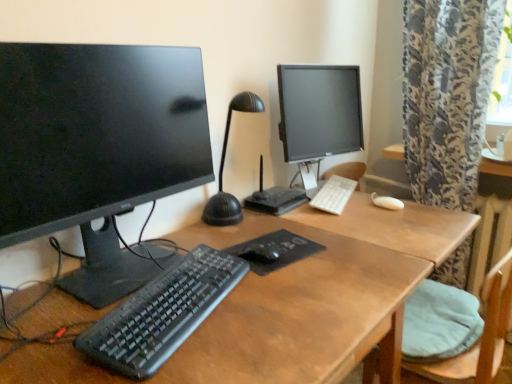
What do you see at coordinates (334, 195) in the screenshot? This screenshot has width=512, height=384. I see `white plastic keyboard at center, the first computer keyboard from the right` at bounding box center [334, 195].

In order to face wooden desk at center, should I rotate leftwards or rightwards?

Turn right by 2.438 degrees to look at wooden desk at center.

This screenshot has height=384, width=512. What do you see at coordinates (293, 302) in the screenshot? I see `wooden desk at center` at bounding box center [293, 302].

This screenshot has height=384, width=512. What do you see at coordinates (274, 251) in the screenshot? I see `black textured mousepad at center` at bounding box center [274, 251].

The image size is (512, 384). What do you see at coordinates (319, 115) in the screenshot? I see `matte black monitor at center, which is counted as the 2th computer monitor, starting from the left` at bounding box center [319, 115].

What do you see at coordinates (261, 253) in the screenshot? I see `black matte mouse at center` at bounding box center [261, 253].

In order to face matte black monitor at left, marked as the second computer monitor in a right-to-left arrangement, should I rotate leftwards or rightwards?

Turn left by 18.591 degrees to look at matte black monitor at left, marked as the second computer monitor in a right-to-left arrangement.

Describe the element at coordinates (97, 148) in the screenshot. The height and width of the screenshot is (384, 512). I see `matte black monitor at left, the first computer monitor when ordered from left to right` at that location.

This screenshot has width=512, height=384. Describe the element at coordinates (162, 313) in the screenshot. I see `black plastic keyboard at center, the first computer keyboard positioned from the bottom` at that location.

What are the coordinates of `light blue fabric cushion at lower right` in the screenshot? It's located at (481, 336).

I want to click on white plastic keyboard at center, which appears as the second computer keyboard when viewed from the front, so click(x=334, y=195).

Which is behind, point (339, 179) or point (143, 104)?

The point (339, 179) is farther from the camera.

Would you say white plastic keyboard at center, which appears as the 2th computer keyboard when viewed from the left, is to the left or to the right of matte black monitor at left, marked as the second computer monitor in a right-to-left arrangement, in the picture?

Based on their positions, white plastic keyboard at center, which appears as the 2th computer keyboard when viewed from the left, is located to the right of matte black monitor at left, marked as the second computer monitor in a right-to-left arrangement.

From a real-world perspective, is white plastic keyboard at center, which appears as the 2th computer keyboard when viewed from the left, positioned under matte black monitor at left, marked as the second computer monitor in a right-to-left arrangement, based on gravity?

Yes, from a real-world perspective, white plastic keyboard at center, which appears as the 2th computer keyboard when viewed from the left, is beneath matte black monitor at left, marked as the second computer monitor in a right-to-left arrangement.

In terms of width, does white plastic keyboard at center, which appears as the second computer keyboard when viewed from the front, look wider or thinner when compared to matte black monitor at left, placed as the 2th computer monitor when sorted from back to front?

Clearly, white plastic keyboard at center, which appears as the second computer keyboard when viewed from the front, has less width compared to matte black monitor at left, placed as the 2th computer monitor when sorted from back to front.

Considering the relative sizes of matte black monitor at left, placed as the 2th computer monitor when sorted from back to front, and black matte mouse at center in the image provided, is matte black monitor at left, placed as the 2th computer monitor when sorted from back to front, thinner than black matte mouse at center?

No, matte black monitor at left, placed as the 2th computer monitor when sorted from back to front, is not thinner than black matte mouse at center.

Considering the sizes of matte black monitor at left, marked as the second computer monitor in a right-to-left arrangement, and black matte mouse at center in the image, is matte black monitor at left, marked as the second computer monitor in a right-to-left arrangement, taller or shorter than black matte mouse at center?

In the image, matte black monitor at left, marked as the second computer monitor in a right-to-left arrangement, appears to be taller than black matte mouse at center.

Is matte black monitor at left, which is the 1th computer monitor from front to back, to the left of black matte mouse at center from the viewer's perspective?

Yes.

Are white plastic keyboard at center, which appears as the 1th computer keyboard when viewed from the back, and black plastic keyboard at center, the 2th computer keyboard viewed from the back, making contact?

No, white plastic keyboard at center, which appears as the 1th computer keyboard when viewed from the back, is not with black plastic keyboard at center, the 2th computer keyboard viewed from the back.

Between white plastic keyboard at center, which appears as the second computer keyboard when viewed from the front, and black plastic keyboard at center, the 2th computer keyboard viewed from the back, which one has smaller size?

white plastic keyboard at center, which appears as the second computer keyboard when viewed from the front.

Considering the relative positions of white plastic keyboard at center, which appears as the second computer keyboard when viewed from the front, and black plastic keyboard at center, the 1th computer keyboard in the front-to-back sequence, in the image provided, is white plastic keyboard at center, which appears as the second computer keyboard when viewed from the front, to the left of black plastic keyboard at center, the 1th computer keyboard in the front-to-back sequence, from the viewer's perspective?

No.

I want to click on computer keyboard above the black plastic keyboard at center, the 2th computer keyboard viewed from the back (from the image's perspective), so click(x=334, y=195).

Which is less distant, (449, 366) or (249, 247)?

Point (449, 366) is farther from the camera than point (249, 247).

Considering the sizes of objects light blue fabric cushion at lower right and black matte mouse at center in the image provided, who is bigger, light blue fabric cushion at lower right or black matte mouse at center?

With larger size is light blue fabric cushion at lower right.

Are light blue fabric cushion at lower right and black matte mouse at center far apart?

That's not correct — light blue fabric cushion at lower right is a little close to black matte mouse at center.

Can you confirm if black plastic keyboard at center, the 2th computer keyboard viewed from the back, is thinner than wooden desk at center?

Correct, the width of black plastic keyboard at center, the 2th computer keyboard viewed from the back, is less than that of wooden desk at center.

Considering the relative sizes of black plastic keyboard at center, placed as the second computer keyboard when sorted from top to bottom, and wooden desk at center in the image provided, is black plastic keyboard at center, placed as the second computer keyboard when sorted from top to bottom, bigger than wooden desk at center?

Actually, black plastic keyboard at center, placed as the second computer keyboard when sorted from top to bottom, might be smaller than wooden desk at center.

Considering the relative positions of black plastic keyboard at center, the first computer keyboard positioned from the bottom, and wooden desk at center in the image provided, is black plastic keyboard at center, the first computer keyboard positioned from the bottom, to the left or to the right of wooden desk at center?

black plastic keyboard at center, the first computer keyboard positioned from the bottom, is positioned on wooden desk at center's left side.

How different are the orientations of black plastic keyboard at center, placed as the second computer keyboard when sorted from top to bottom, and wooden desk at center in degrees?

The facing directions of black plastic keyboard at center, placed as the second computer keyboard when sorted from top to bottom, and wooden desk at center are 17.7 degrees apart.

Is black textured mousepad at center oriented towards black matte mouse at center?

No.

Is black textured mousepad at center positioned before black matte mouse at center?

Yes, it is in front of black matte mouse at center.

Which of these two, black textured mousepad at center or black matte mouse at center, is smaller?

black matte mouse at center.

Between black textured mousepad at center and black matte mouse at center, which one appears on the left side from the viewer's perspective?

black matte mouse at center.

Is point (238, 252) more distant than point (231, 278)?

That is True.

Which object is wider, black textured mousepad at center or black plastic keyboard at center, placed as the second computer keyboard when sorted from top to bottom?

black textured mousepad at center is wider.

Would you say black textured mousepad at center is to the left or to the right of black plastic keyboard at center, the 1th computer keyboard in the front-to-back sequence, in the picture?

Clearly, black textured mousepad at center is on the right of black plastic keyboard at center, the 1th computer keyboard in the front-to-back sequence, in the image.

How much distance is there between black textured mousepad at center and black plastic keyboard at center, the 1th computer keyboard in the front-to-back sequence?

8.51 inches.

The image size is (512, 384). I want to click on the 1st computer keyboard below the matte black monitor at left, placed as the 2th computer monitor when sorted from back to front (from the image's perspective), so click(x=334, y=195).

Where is `mouse below the matte black monitor at left, marked as the second computer monitor in a right-to-left arrangement (from a real-world perspective)`? Image resolution: width=512 pixels, height=384 pixels. mouse below the matte black monitor at left, marked as the second computer monitor in a right-to-left arrangement (from a real-world perspective) is located at coordinates (261, 253).

Which object lies nearer to the anchor point white plastic keyboard at center, which appears as the second computer keyboard when viewed from the front, matte black monitor at center, which is counted as the 2th computer monitor, starting from the left, or matte black monitor at left, marked as the second computer monitor in a right-to-left arrangement?

matte black monitor at center, which is counted as the 2th computer monitor, starting from the left, is closer to white plastic keyboard at center, which appears as the second computer keyboard when viewed from the front.

Which object lies nearer to the anchor point wooden desk at center, white plastic keyboard at center, placed as the 2th computer keyboard when sorted from bottom to top, or light blue fabric cushion at lower right?

Among the two, light blue fabric cushion at lower right is located nearer to wooden desk at center.

When comparing their distances from wooden desk at center, does matte black monitor at left, the first computer monitor when ordered from left to right, or light blue fabric cushion at lower right seem closer?

Among the two, light blue fabric cushion at lower right is located nearer to wooden desk at center.

Estimate the real-world distances between objects in this image. Which object is further from black textured mousepad at center, matte black monitor at left, placed as the 2th computer monitor when sorted from back to front, or light blue fabric cushion at lower right?

light blue fabric cushion at lower right is positioned further to the anchor black textured mousepad at center.

Consider the image. Based on their spatial positions, is black textured mousepad at center or black matte mouse at center further from wooden desk at center?

black matte mouse at center.

Looking at the image, which one is located further to black textured mousepad at center, matte black monitor at center, which is the 1th computer monitor from right to left, or wooden desk at center?

The object further to black textured mousepad at center is matte black monitor at center, which is the 1th computer monitor from right to left.

When comparing their distances from light blue fabric cushion at lower right, does matte black monitor at left, which is the 1th computer monitor from front to back, or white plastic keyboard at center, placed as the 2th computer keyboard when sorted from bottom to top, seem further?

matte black monitor at left, which is the 1th computer monitor from front to back, is further to light blue fabric cushion at lower right.

Considering their positions, is matte black monitor at left, marked as the second computer monitor in a right-to-left arrangement, positioned closer to white plastic keyboard at center, which is counted as the first computer keyboard, starting from the top, than black matte mouse at center?

Among the two, black matte mouse at center is located nearer to white plastic keyboard at center, which is counted as the first computer keyboard, starting from the top.

At what (x,y) coordinates should I click in order to perform the action: click on mousepad between matte black monitor at left, which is the 1th computer monitor from front to back, and black matte mouse at center from front to back. Please return your answer as a coordinate pair (x, y). The height and width of the screenshot is (384, 512). Looking at the image, I should click on (274, 251).

Find the location of a particular element. mouse between black plastic keyboard at center, the first computer keyboard positioned from the bottom, and white plastic keyboard at center, placed as the 2th computer keyboard when sorted from bottom to top, in the front-back direction is located at coordinates (261, 253).

Locate an element on the screen. This screenshot has height=384, width=512. mousepad between black plastic keyboard at center, the 2th computer keyboard viewed from the back, and white plastic keyboard at center, which appears as the 1th computer keyboard when viewed from the back, in the front-back direction is located at coordinates click(274, 251).

The width and height of the screenshot is (512, 384). Find the location of `computer monitor between matte black monitor at left, which is the 1th computer monitor from front to back, and light blue fabric cushion at lower right from left to right`. computer monitor between matte black monitor at left, which is the 1th computer monitor from front to back, and light blue fabric cushion at lower right from left to right is located at coordinates (319, 115).